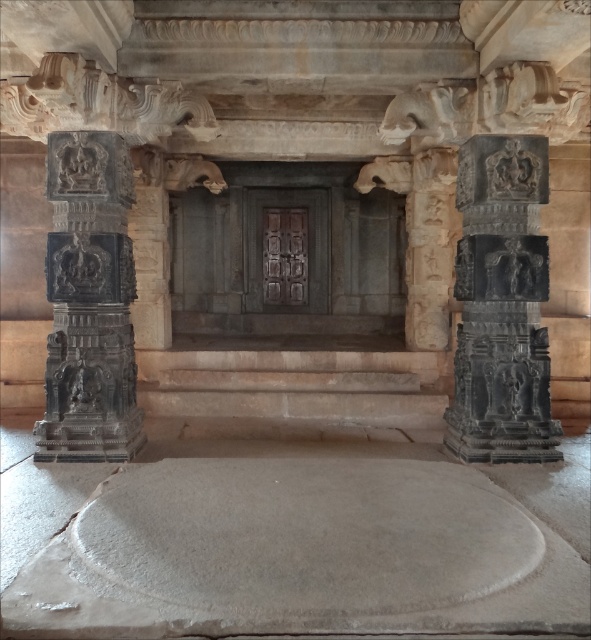
You are an archaeologist examining the stone structure. You need to determine which object is bigger between the dark gray stone column at right and the black stone statue at left. Based on the scene, which one is larger?

The dark gray stone column at right has a larger size compared to the black stone statue at left, so the dark gray stone column at right is larger.

You are an architect examining the stone structure. You need to determine which object has a greater width between the dark gray stone column at right and the black stone statue at left. Based on the scene, which one is wider?

The dark gray stone column at right is wider than the black stone statue at left according to the description.